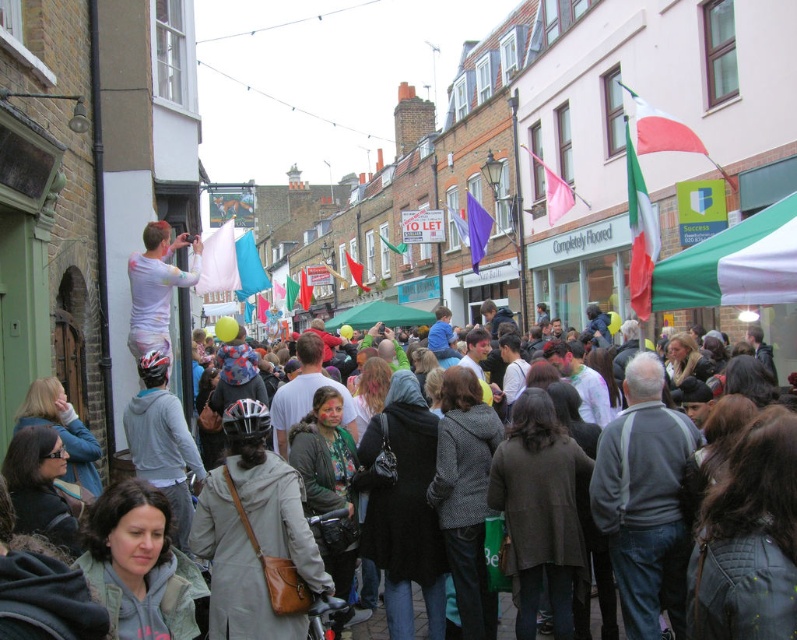
Does point (790, 212) come in front of point (379, 636)?

Yes, point (790, 212) is in front of point (379, 636).

Who is higher up, green/white fabric canopy at center-right or multicolored fabric at center?

green/white fabric canopy at center-right is higher up.

Where is `green/white fabric canopy at center-right`? This screenshot has width=797, height=640. green/white fabric canopy at center-right is located at coordinates (733, 264).